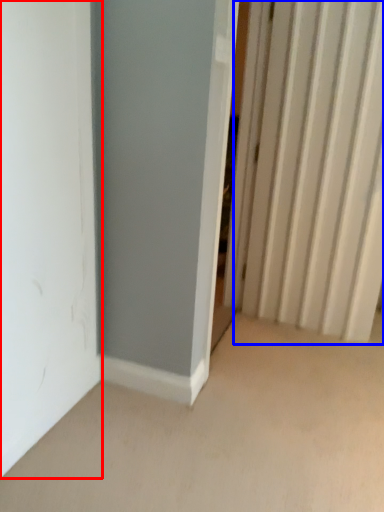
Question: Among these objects, which one is farthest to the camera, door (highlighted by a red box) or radiator (highlighted by a blue box)?

Choices:
 (A) door
 (B) radiator

Answer: (B)